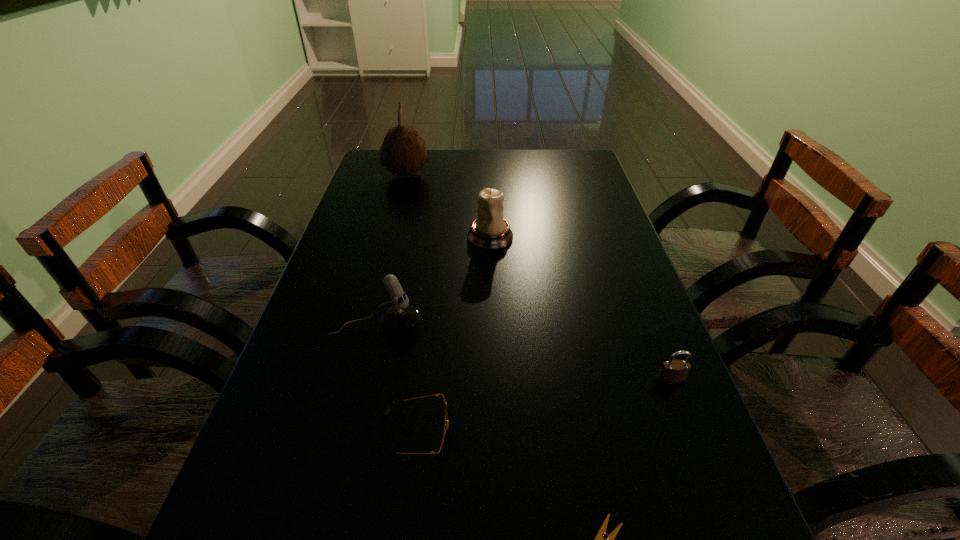
I want to click on free space located on the right of the second farthest object, so pyautogui.click(x=540, y=238).

Identify the location of free space located 0.380m on the back of the microphone. Image resolution: width=960 pixels, height=540 pixels. (402, 218).

At what (x,y) coordinates should I click in order to perform the action: click on vacant space located 0.230m on the left of the rightmost object. Please return your answer as a coordinate pair (x, y). Image resolution: width=960 pixels, height=540 pixels. Looking at the image, I should click on (536, 381).

Where is `vacant space located on the front-facing side of the sunglasses`? The image size is (960, 540). vacant space located on the front-facing side of the sunglasses is located at coordinates (670, 433).

Find the location of `object at the far edge`. object at the far edge is located at coordinates (403, 152).

This screenshot has height=540, width=960. In order to click on coconut at the left edge in this screenshot , I will do `click(403, 152)`.

Find the location of a particular element. Image resolution: width=960 pixels, height=540 pixels. microphone that is at the left edge is located at coordinates (401, 318).

Find the location of a particular element. object that is at the right edge is located at coordinates (673, 372).

The height and width of the screenshot is (540, 960). What are the coordinates of `object positioned at the far left corner` in the screenshot? It's located at (403, 152).

In the image, there is a desktop. Where is `free region at the far edge`? free region at the far edge is located at coordinates (516, 165).